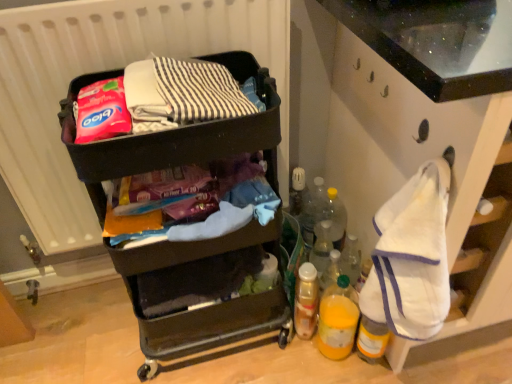
Question: Choose the correct answer: Is translucent plastic bottle at lower right, the 1th bottle from the top, inside white fabric at right or outside it?

Choices:
 (A) inside
 (B) outside

Answer: (B)

Question: Is translucent plastic bottle at lower right, the 1th bottle from the top, wider or thinner than white fabric at right?

Choices:
 (A) thin
 (B) wide

Answer: (A)

Question: Considering the real-world distances, which object is farthest from the matte black suitcase at upper center, which is the second waste from bottom to top?

Choices:
 (A) black plastic cart at upper left
 (B) white matte radiator at upper left
 (C) translucent yellow bottle at lower right, the fourth bottle positioned from the top
 (D) matte plastic cart at center, the first waste ordered from the bottom
 (E) translucent plastic bottle at lower right, the third bottle from the bottom

Answer: (C)

Question: Estimate the real-world distances between objects in this image. Which object is closer to the white fabric at right?

Choices:
 (A) black plastic cart at upper left
 (B) matte black suitcase at upper center, which is the second waste from bottom to top
 (C) translucent plastic bottle at lower right, the third bottle from the bottom
 (D) white matte radiator at upper left
 (E) translucent plastic spray can at lower center, placed as the 2th bottle when sorted from bottom to top

Answer: (E)